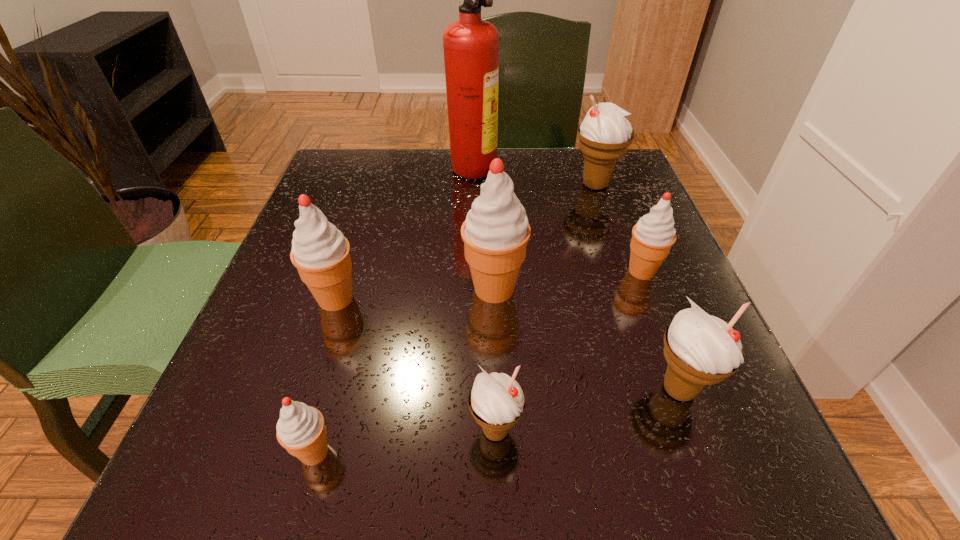
Identify the location of vacant point located between the biggest white icecream and the smallest white icecream. This screenshot has height=540, width=960. point(545,307).

This screenshot has height=540, width=960. What are the coordinates of `free space between the second biggest white icecream and the fire extinguisher` in the screenshot? It's located at (576, 278).

You are a GUI agent. You are given a task and a screenshot of the screen. Output one action in this format:
    pyautogui.click(x=<x>, y=<y>)
    Task: Click on the free space between the second biggest red icecream and the red fire extinguisher
    The width and height of the screenshot is (960, 540).
    Given the screenshot: What is the action you would take?
    pyautogui.click(x=404, y=232)

Locate an element on the screen. This screenshot has width=960, height=540. empty space that is in between the leftmost white icecream and the tallest icecream is located at coordinates (494, 360).

Locate an element on the screen. This screenshot has height=540, width=960. unoccupied area between the rightmost red icecream and the leftmost white icecream is located at coordinates (568, 351).

This screenshot has width=960, height=540. Identify the location of vacant region between the smallest red icecream and the farthest icecream. (455, 319).

This screenshot has height=540, width=960. I want to click on object that is the closest to the smallest red icecream, so tap(497, 401).

Identify which object is the seventh nearest to the biggest white icecream. Please provide its 2D coordinates. Your answer should be formatted as a tuple, i.e. [(x, y)], where the tuple contains the x and y coordinates of a point satisfying the conditions above.

[(301, 430)]

Locate an element on the screen. This screenshot has height=540, width=960. the third closest icecream relative to the rightmost red icecream is located at coordinates (605, 134).

You are a GUI agent. You are given a task and a screenshot of the screen. Output one action in this format:
    pyautogui.click(x=<x>, y=<y>)
    Task: Click on the fourth closest icecream to the smallest red icecream
    This screenshot has height=540, width=960.
    Given the screenshot: What is the action you would take?
    pyautogui.click(x=700, y=349)